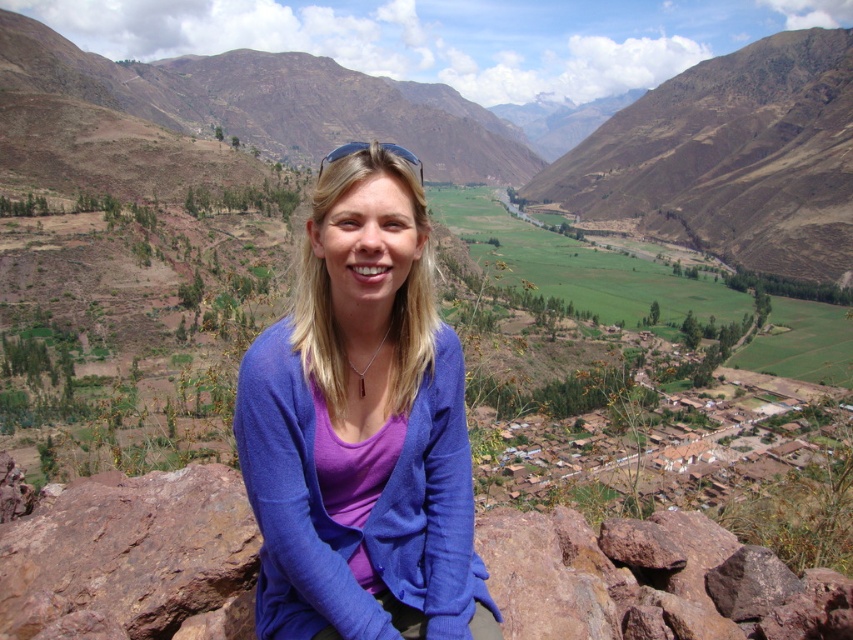
You are a photographer trying to capture the purple soft sweater at center and the rusty rock at center in the same frame. Based on their positions, which object would appear closer to the camera in the photo?

The purple soft sweater at center appears closer to the camera because it is positioned in front of the rusty rock at center.

You are a fashion designer observing the scene. You need to decide which item, the purple soft sweater at center or the rusty rock at center, can be easily folded and stored in a small suitcase. Based on their thickness, which would be more suitable?

The purple soft sweater at center is thinner than the rusty rock at center, so it can be easily folded and stored in a small suitcase.